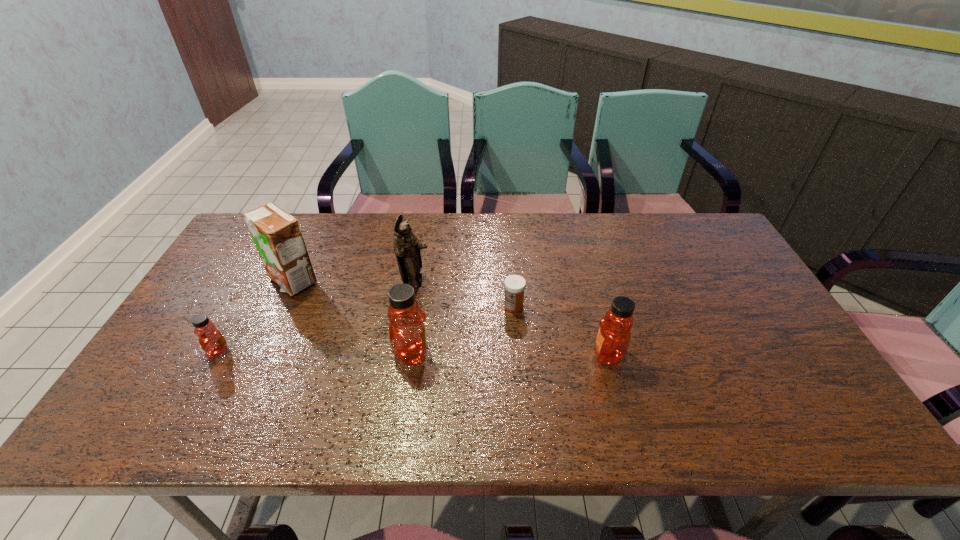
In the current image, all honeys are evenly spaced. To maintain this equal spacing, where should an additional honey be placed on the right? Please point out a free spot. Please provide its 2D coordinates. Your answer should be formatted as a tuple, i.e. [(x, y)], where the tuple contains the x and y coordinates of a point satisfying the conditions above.

[(804, 356)]